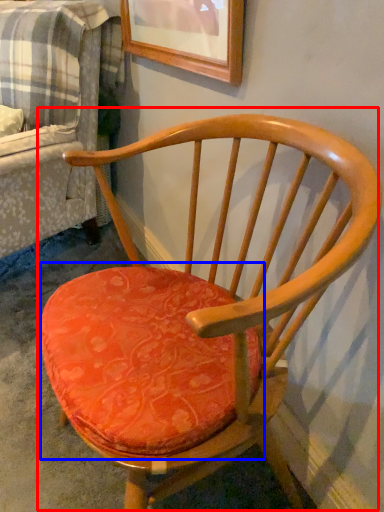
Question: Which point is closer to the camera, chair (highlighted by a red box) or table (highlighted by a blue box)?

Choices:
 (A) chair
 (B) table

Answer: (A)